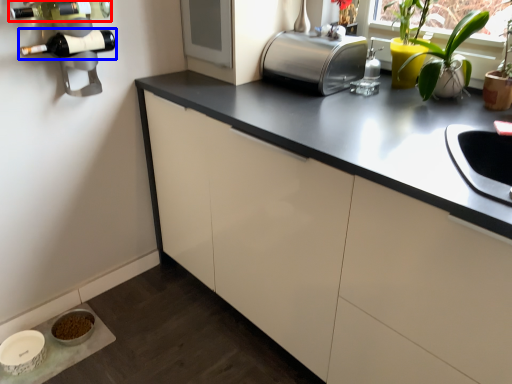
Question: Which of the following is the farthest to the observer, wine bottle (highlighted by a red box) or wine bottle (highlighted by a blue box)?

Choices:
 (A) wine bottle
 (B) wine bottle

Answer: (B)